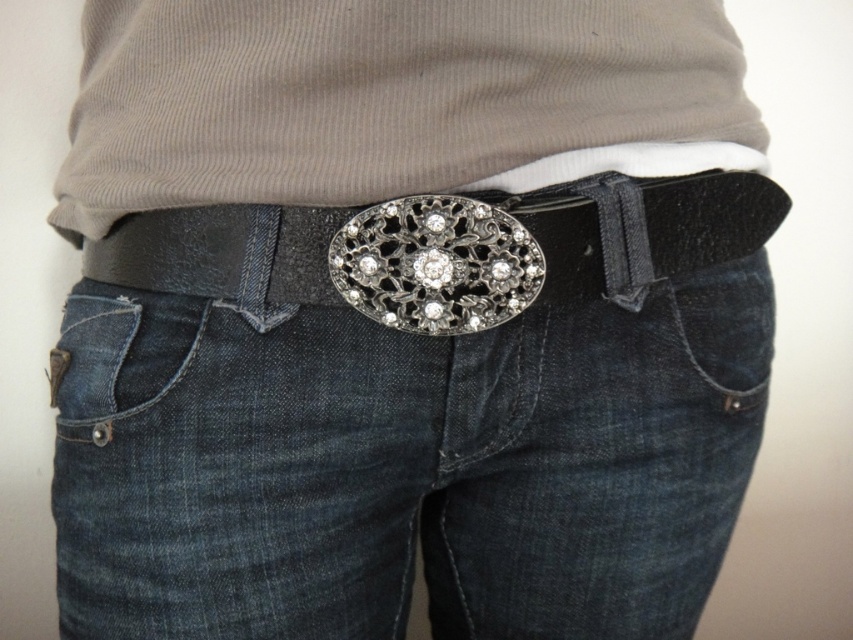
Can you confirm if metallic silver buckle at center is wider than denim at lower left?

Correct, the width of metallic silver buckle at center exceeds that of denim at lower left.

Between metallic silver buckle at center and denim at lower left, which one is positioned lower?

denim at lower left

Between point (115, 260) and point (77, 294), which one is positioned behind?

Point (77, 294)

Locate an element on the screen. The image size is (853, 640). metallic silver buckle at center is located at coordinates (457, 253).